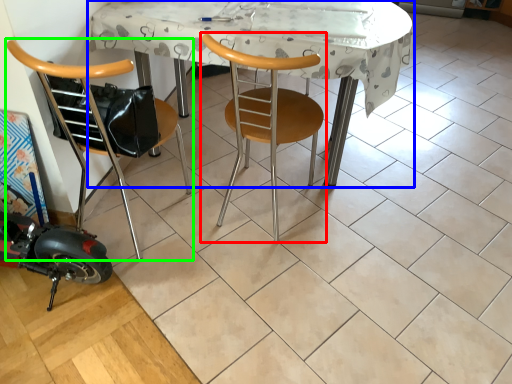
Question: Which is farther away from chair (highlighted by a red box)? table (highlighted by a blue box) or chair (highlighted by a green box)?

Choices:
 (A) table
 (B) chair

Answer: (B)